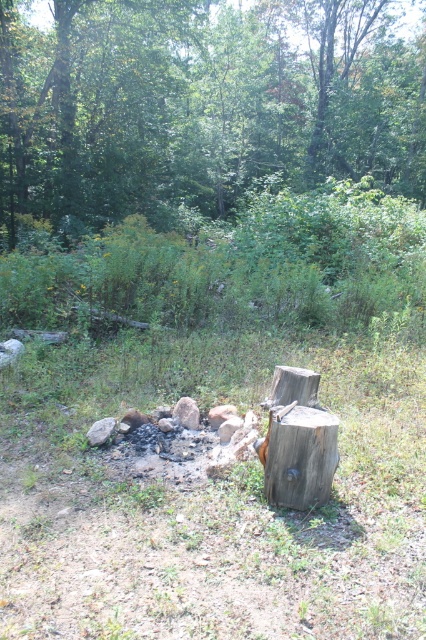
Does green leafy tree at upper center lie in front of weathered brown wood at center?

No.

Can you confirm if green leafy tree at upper center is bigger than weathered brown wood at center?

Yes, green leafy tree at upper center is bigger than weathered brown wood at center.

I want to click on green leafy tree at upper center, so click(201, 104).